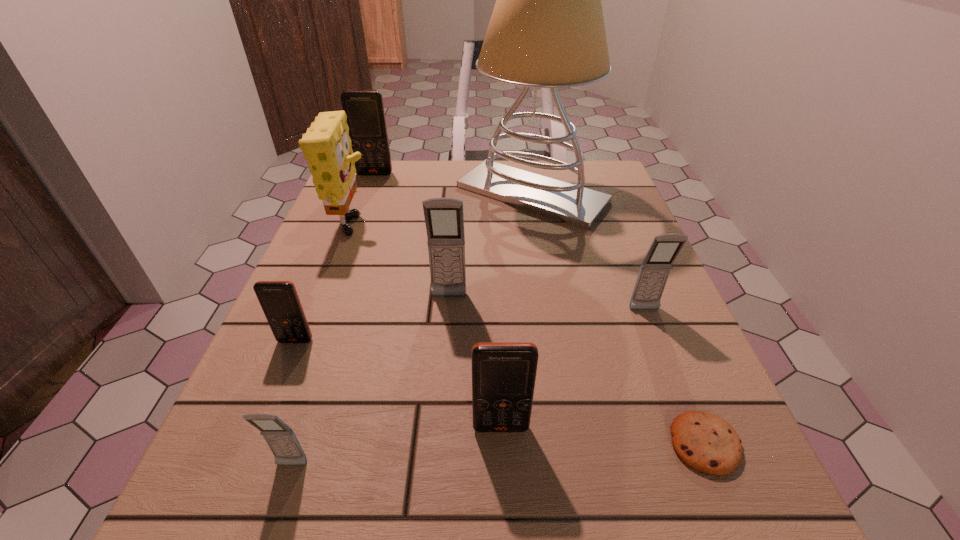
The width and height of the screenshot is (960, 540). I want to click on free space between the yellow sponge and the second cellular telephone from right to left, so click(426, 329).

Identify the location of vacant space that is in between the sponge and the shortest object. (528, 337).

Find the location of a particular element. The image size is (960, 540). free space between the second farthest gray cellular telephone and the cookie is located at coordinates (675, 377).

You are a GUI agent. You are given a task and a screenshot of the screen. Output one action in this format:
    pyautogui.click(x=<x>, y=<y>)
    Task: Click on the unoccupied position between the tallest object and the farthest cellular telephone
    
    Given the screenshot: What is the action you would take?
    pyautogui.click(x=453, y=184)

This screenshot has height=540, width=960. I want to click on free space between the fifth cellular telephone from left to right and the tallest object, so click(516, 310).

The width and height of the screenshot is (960, 540). I want to click on free spot between the third nearest cellular telephone and the fourth cellular telephone from left to right, so click(372, 319).

Where is `vacant area that lies between the second biggest gray cellular telephone and the shortest object`? vacant area that lies between the second biggest gray cellular telephone and the shortest object is located at coordinates (675, 377).

You are a GUI agent. You are given a task and a screenshot of the screen. Output one action in this format:
    pyautogui.click(x=<x>, y=<y>)
    Task: Click on the object that is the sixth closest to the beige table lamp
    
    Given the screenshot: What is the action you would take?
    tap(705, 442)

Identify which object is the fourth nearest to the smallest gray cellular telephone. Please provide its 2D coordinates. Your answer should be formatted as a tuple, i.e. [(x, y)], where the tuple contains the x and y coordinates of a point satisfying the conditions above.

[(326, 145)]

Where is `cellular telephone that is the fifth nearest to the yellow sponge`? The height and width of the screenshot is (540, 960). cellular telephone that is the fifth nearest to the yellow sponge is located at coordinates (503, 373).